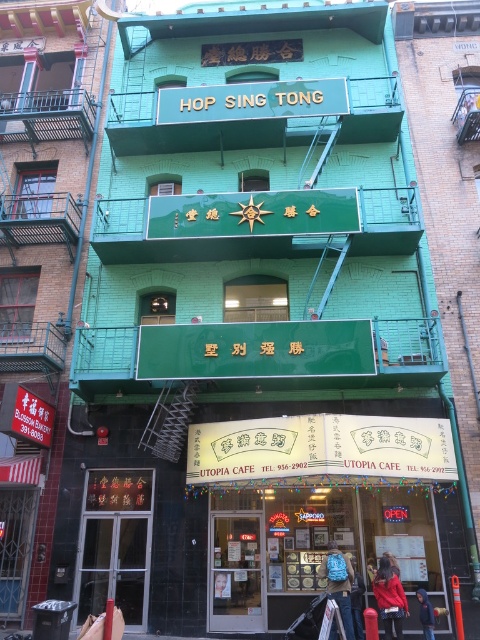
How distant is matte yellow signboard at center from blue fabric bag at center?

The distance of matte yellow signboard at center from blue fabric bag at center is 4.14 feet.

This screenshot has width=480, height=640. What do you see at coordinates (314, 545) in the screenshot?
I see `matte yellow signboard at center` at bounding box center [314, 545].

Who is more forward, (305, 506) or (351, 572)?

Point (351, 572)

Identify the location of matte yellow signboard at center. (314, 545).

Locate an element on the screen. matte yellow signboard at center is located at coordinates (314, 545).

Is matte yellow signboard at center smaller than red fabric coat at lower right?

Incorrect, matte yellow signboard at center is not smaller in size than red fabric coat at lower right.

Between point (396, 531) and point (397, 618), which one is positioned behind?

Point (396, 531)

Find the location of a particular element. The width and height of the screenshot is (480, 640). matte yellow signboard at center is located at coordinates (314, 545).

Between green matte building at center and red fabric coat at lower right, which one is positioned higher?

green matte building at center is higher up.

Where is `green matte building at center`? This screenshot has width=480, height=640. green matte building at center is located at coordinates (39, 262).

Does point (44, 589) come closer to viewer compared to point (389, 572)?

No, (44, 589) is further to viewer.

Find the location of `green matte building at center`. green matte building at center is located at coordinates (39, 262).